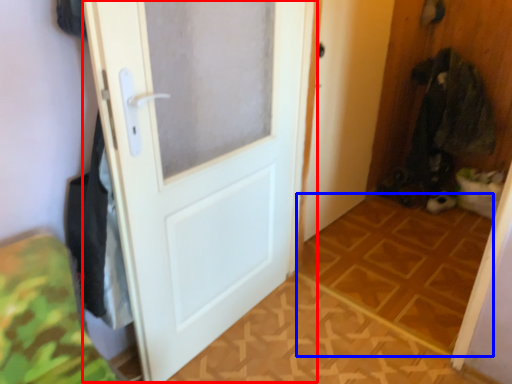
Question: Which point is closer to the camera, door (highlighted by a red box) or tile (highlighted by a blue box)?

Choices:
 (A) door
 (B) tile

Answer: (A)